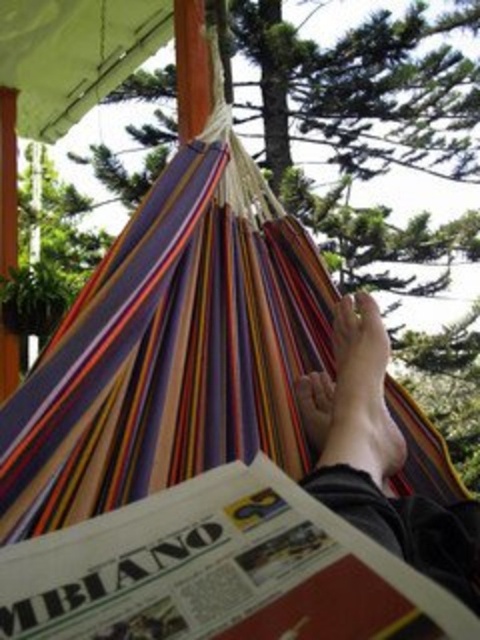
Does multicolored fabric feet at center have a lesser width compared to smooth skin foot at lower center?

In fact, multicolored fabric feet at center might be wider than smooth skin foot at lower center.

The height and width of the screenshot is (640, 480). Identify the location of multicolored fabric feet at center. (377, 458).